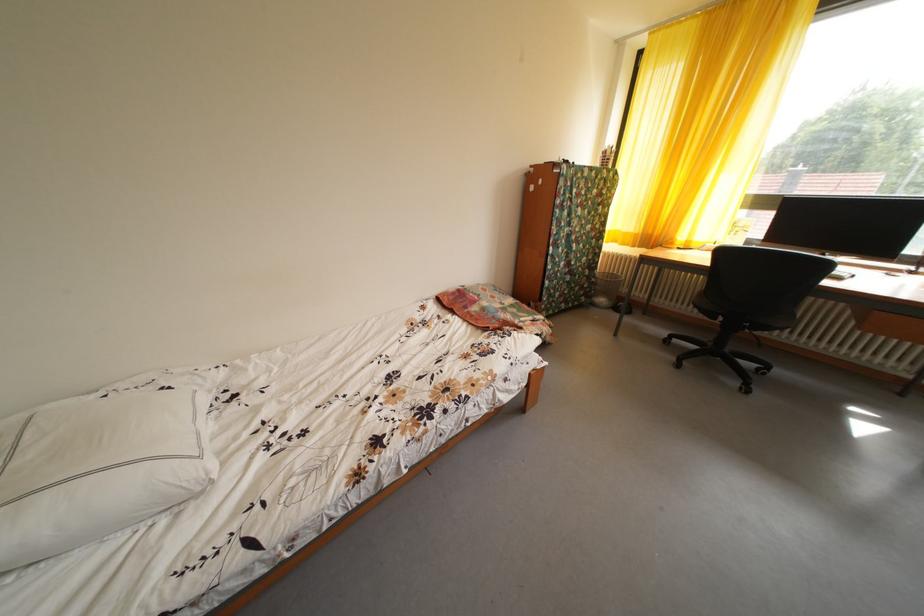
Find the location of a particular element. Image resolution: width=924 pixels, height=616 pixels. wire trash can is located at coordinates (605, 288).